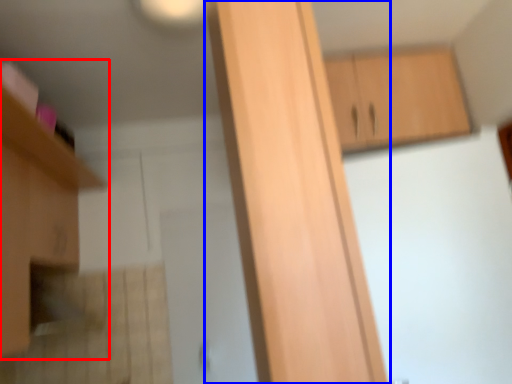
Question: Which object appears closest to the camera in this image, cabinetry (highlighted by a red box) or cabinetry (highlighted by a blue box)?

Choices:
 (A) cabinetry
 (B) cabinetry

Answer: (B)